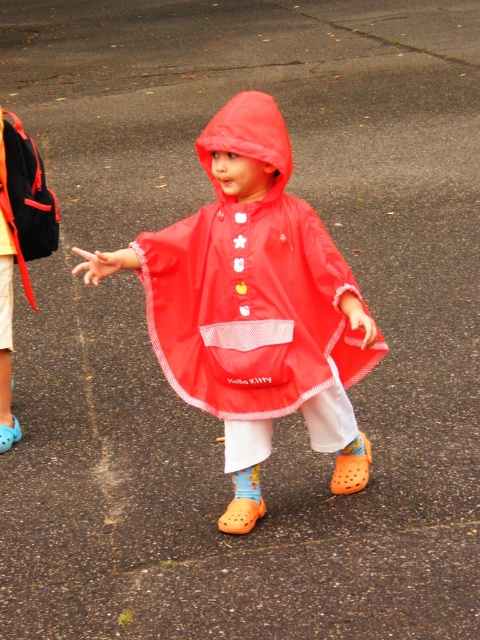
Question: Can you confirm if matte red raincoat at center is positioned to the left of matte black backpack at left?

Choices:
 (A) no
 (B) yes

Answer: (A)

Question: Does matte red raincoat at center appear on the right side of matte black backpack at left?

Choices:
 (A) yes
 (B) no

Answer: (A)

Question: Does matte red raincoat at center appear on the right side of matte black backpack at left?

Choices:
 (A) yes
 (B) no

Answer: (A)

Question: Which point is farther to the camera?

Choices:
 (A) matte black backpack at left
 (B) matte red raincoat at center

Answer: (A)

Question: Which point is farther from the camera taking this photo?

Choices:
 (A) (0, 417)
 (B) (122, 248)

Answer: (B)